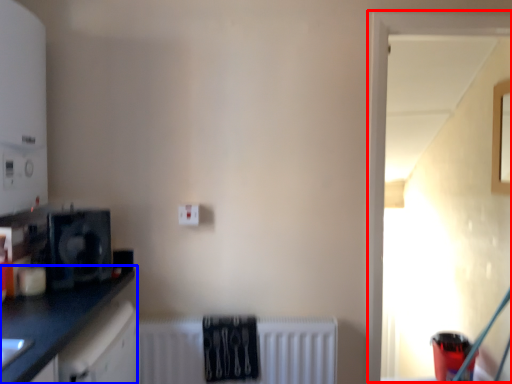
Question: Which object appears closest to the camera in this image, window (highlighted by a red box) or countertop (highlighted by a blue box)?

Choices:
 (A) window
 (B) countertop

Answer: (B)